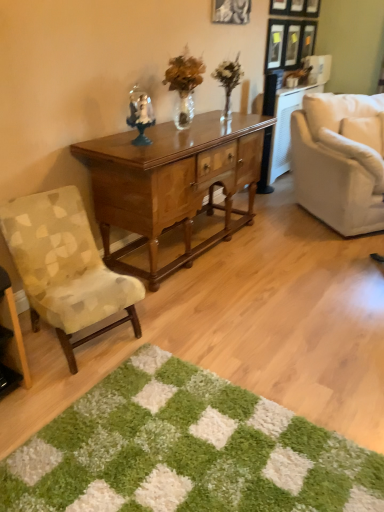
Locate an element on the screen. This screenshot has width=384, height=512. free space that is in between polished wood desk at center and white fabric chair at right, the first chair in the back-to-front sequence is located at coordinates (272, 245).